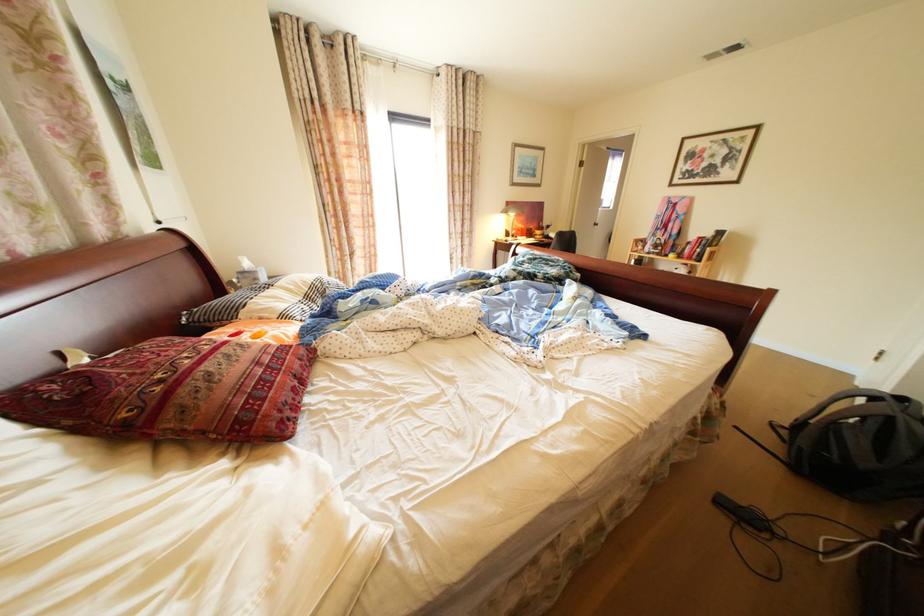
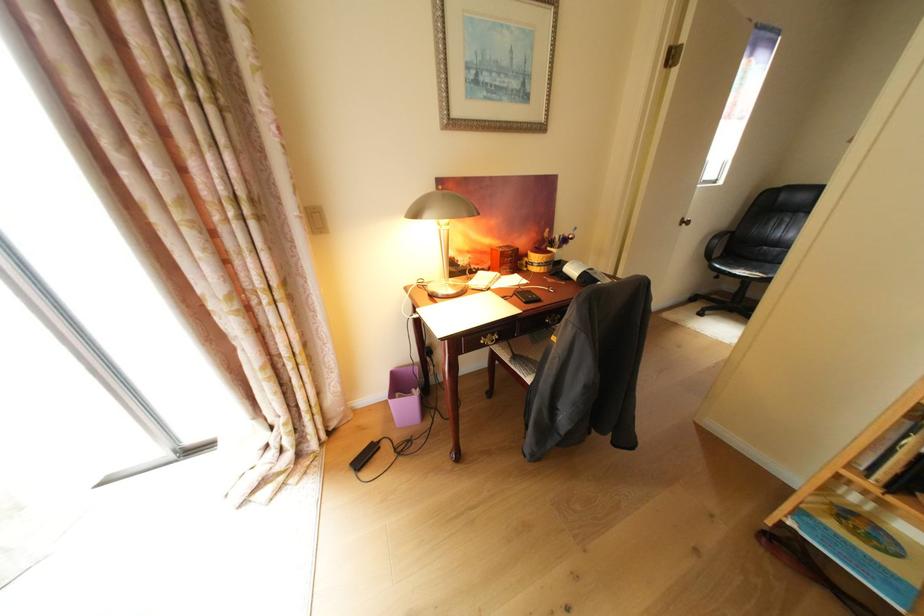
What movement of the cameraman would produce the second image?

The movement direction of the cameraman is right, forward.